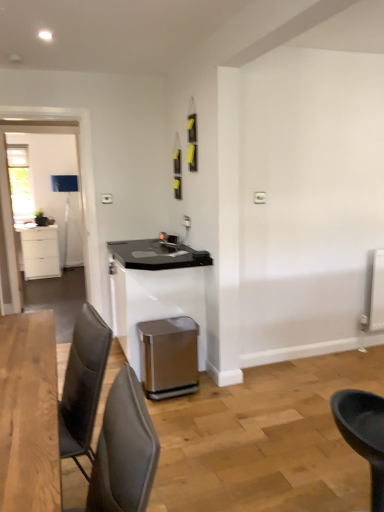
This screenshot has height=512, width=384. What do you see at coordinates (363, 433) in the screenshot? I see `black plastic chair at lower right, the 2th chair when ordered from left to right` at bounding box center [363, 433].

In order to click on satin white table at center in this screenshot , I will do `click(155, 290)`.

Image resolution: width=384 pixels, height=512 pixels. What are the coordinates of `white matte cabinet at left` in the screenshot? It's located at (39, 251).

I want to click on satin metallic trash can at lower center, so click(169, 357).

Image resolution: width=384 pixels, height=512 pixels. Identify the location of black plastic chair at lower right, the 2th chair when ordered from left to right. (363, 433).

Is point (56, 275) positioned in front of point (124, 493)?

No.

Between white matte cabinet at left and gray fabric chair at lower left, the 2th chair in the right-to-left sequence, which one has more height?

Standing taller between the two is white matte cabinet at left.

From the image's perspective, which is above, white matte cabinet at left or gray fabric chair at lower left, the 2th chair positioned from the back?

white matte cabinet at left is shown above in the image.

Is white matte cabinet at left not within gray fabric chair at lower left, the 2th chair positioned from the back?

white matte cabinet at left lies outside gray fabric chair at lower left, the 2th chair positioned from the back,'s area.

Based on the photo, how many degrees apart are the facing directions of black plastic chair at lower right, the second chair in the front-to-back sequence, and white matte cabinet at left?

45.7 degrees.

Between black plastic chair at lower right, the second chair in the front-to-back sequence, and white matte cabinet at left, which one appears on the right side from the viewer's perspective?

black plastic chair at lower right, the second chair in the front-to-back sequence, is more to the right.

From the white matte cabinet at left, count 1st chairs forward and point to it. Please provide its 2D coordinates.

[(363, 433)]

Who is bigger, black plastic chair at lower right, the second chair in the front-to-back sequence, or white matte cabinet at left?

Bigger between the two is white matte cabinet at left.

From the image's perspective, between clear glass door at left and satin white table at center, who is located below?

From the image's view, satin white table at center is below.

Which is more to the right, clear glass door at left or satin white table at center?

satin white table at center.

Considering the relative sizes of clear glass door at left and satin white table at center in the image provided, is clear glass door at left bigger than satin white table at center?

Incorrect, clear glass door at left is not larger than satin white table at center.

The image size is (384, 512). In order to click on glass door above the satin white table at center (from a real-world perspective) in this screenshot , I will do 42,201.

Can you tell me how much black plastic chair at lower right, placed as the first chair when sorted from back to front, and satin metallic trash can at lower center differ in facing direction?

black plastic chair at lower right, placed as the first chair when sorted from back to front, and satin metallic trash can at lower center are facing 136 degrees away from each other.

From a real-world perspective, is black plastic chair at lower right, the second chair in the front-to-back sequence, above or below satin metallic trash can at lower center?

Clearly, from a real-world perspective, black plastic chair at lower right, the second chair in the front-to-back sequence, is above satin metallic trash can at lower center.

Would you say black plastic chair at lower right, the second chair in the front-to-back sequence, is outside satin metallic trash can at lower center?

That's correct, black plastic chair at lower right, the second chair in the front-to-back sequence, is outside of satin metallic trash can at lower center.

Considering the relative sizes of gray fabric chair at lower left, the 1th chair in the front-to-back sequence, and satin metallic trash can at lower center in the image provided, is gray fabric chair at lower left, the 1th chair in the front-to-back sequence, thinner than satin metallic trash can at lower center?

Yes, gray fabric chair at lower left, the 1th chair in the front-to-back sequence, is thinner than satin metallic trash can at lower center.

Which point is more forward, [155,450] or [168,379]?

The point [155,450] is closer.

In the scene shown: Is gray fabric chair at lower left, the 1th chair in the front-to-back sequence, bigger or smaller than satin metallic trash can at lower center?

Considering their sizes, gray fabric chair at lower left, the 1th chair in the front-to-back sequence, takes up more space than satin metallic trash can at lower center.

Is gray fabric chair at lower left, the 2th chair positioned from the back, touching satin metallic trash can at lower center?

No, gray fabric chair at lower left, the 2th chair positioned from the back, is not with satin metallic trash can at lower center.

What's the angular difference between gray fabric chair at lower left, the 2th chair positioned from the back, and black plastic chair at lower right, placed as the first chair when sorted from right to left,'s facing directions?

The angle between the facing direction of gray fabric chair at lower left, the 2th chair positioned from the back, and the facing direction of black plastic chair at lower right, placed as the first chair when sorted from right to left, is 138 degrees.

Considering the positions of points (127, 388) and (359, 401), is point (127, 388) closer to camera compared to point (359, 401)?

Yes, point (127, 388) is in front of point (359, 401).

Is gray fabric chair at lower left, the first chair positioned from the left, taller or shorter than black plastic chair at lower right, the second chair in the front-to-back sequence?

gray fabric chair at lower left, the first chair positioned from the left, is shorter than black plastic chair at lower right, the second chair in the front-to-back sequence.

Is gray fabric chair at lower left, the 2th chair positioned from the back, wider or thinner than black plastic chair at lower right, the second chair in the front-to-back sequence?

In the image, gray fabric chair at lower left, the 2th chair positioned from the back, appears to be wider than black plastic chair at lower right, the second chair in the front-to-back sequence.

Which is more distant, (18, 227) or (48, 155)?

The point (48, 155) is farther.

Between white matte cabinet at left and clear glass door at left, which one has smaller width?

clear glass door at left is thinner.

Is clear glass door at left surrounded by white matte cabinet at left?

No, white matte cabinet at left does not contain clear glass door at left.

Locate an element on the screen. This screenshot has width=384, height=512. the 1st chair to the right of the white matte cabinet at left, counting from the anchor's position is located at coordinates (123, 451).

Find the location of a particular element. The image size is (384, 512). cabinetry on the left of black plastic chair at lower right, the second chair in the front-to-back sequence is located at coordinates (39, 251).

Looking at this image, looking at the image, which one is located closer to black plastic chair at lower right, the 2th chair when ordered from left to right, gray fabric chair at lower left, the 1th chair in the front-to-back sequence, or satin white table at center?

Among the two, gray fabric chair at lower left, the 1th chair in the front-to-back sequence, is located nearer to black plastic chair at lower right, the 2th chair when ordered from left to right.

In the scene shown: Estimate the real-world distances between objects in this image. Which object is further from satin metallic trash can at lower center, clear glass door at left or satin white table at center?

Based on the image, clear glass door at left appears to be further to satin metallic trash can at lower center.

Estimate the real-world distances between objects in this image. Which object is closer to white matte cabinet at left, satin white table at center or satin metallic trash can at lower center?

satin white table at center lies closer to white matte cabinet at left than the other object.

Estimate the real-world distances between objects in this image. Which object is closer to black plastic chair at lower right, placed as the first chair when sorted from back to front, gray fabric chair at lower left, the 1th chair in the front-to-back sequence, or clear glass door at left?

gray fabric chair at lower left, the 1th chair in the front-to-back sequence, lies closer to black plastic chair at lower right, placed as the first chair when sorted from back to front, than the other object.

Which object lies further to the anchor point black plastic chair at lower right, the second chair in the front-to-back sequence, white matte cabinet at left or satin metallic trash can at lower center?

white matte cabinet at left is further to black plastic chair at lower right, the second chair in the front-to-back sequence.

Consider the image. Considering their positions, is clear glass door at left positioned closer to white matte cabinet at left than black plastic chair at lower right, placed as the first chair when sorted from right to left?

clear glass door at left is positioned closer to the anchor white matte cabinet at left.

From the image, which object appears to be farther from black plastic chair at lower right, placed as the first chair when sorted from right to left, satin metallic trash can at lower center or white matte cabinet at left?

The object further to black plastic chair at lower right, placed as the first chair when sorted from right to left, is white matte cabinet at left.

When comparing their distances from white matte cabinet at left, does gray fabric chair at lower left, the 2th chair in the right-to-left sequence, or satin white table at center seem closer?

satin white table at center.

The height and width of the screenshot is (512, 384). Identify the location of table positioned between black plastic chair at lower right, the second chair in the front-to-back sequence, and clear glass door at left from near to far. (155, 290).

What are the coordinates of `waste container between gray fabric chair at lower left, the 2th chair in the right-to-left sequence, and satin white table at center, along the z-axis` in the screenshot? It's located at (169, 357).

Where is `table between satin metallic trash can at lower center and clear glass door at left along the z-axis`? This screenshot has height=512, width=384. table between satin metallic trash can at lower center and clear glass door at left along the z-axis is located at coordinates (155, 290).

In order to click on glass door positioned between gray fabric chair at lower left, the 2th chair positioned from the back, and white matte cabinet at left from near to far in this screenshot , I will do `click(42, 201)`.